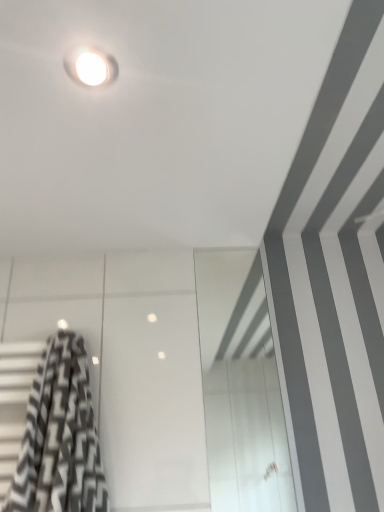
Where is `gray zigzag fabric towel at lower left`? Image resolution: width=384 pixels, height=512 pixels. gray zigzag fabric towel at lower left is located at coordinates (59, 436).

This screenshot has height=512, width=384. Describe the element at coordinates (59, 436) in the screenshot. I see `gray zigzag fabric towel at lower left` at that location.

Identify the location of gray zigzag fabric towel at lower left. This screenshot has height=512, width=384. (59, 436).